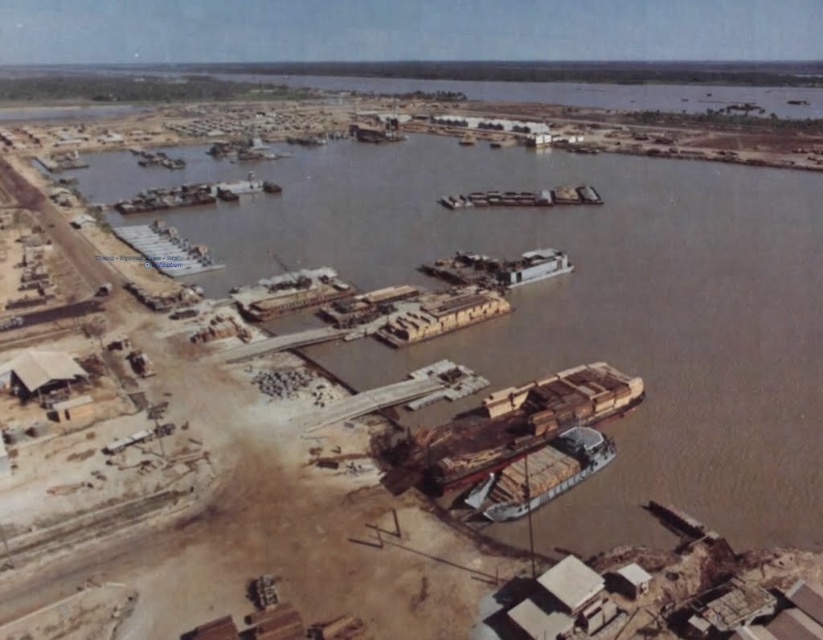
Question: Is wooden planks at center thinner than wooden planks boat at center?

Choices:
 (A) yes
 (B) no

Answer: (A)

Question: Estimate the real-world distances between objects in this image. Which object is closer to the wooden planks boat at center?

Choices:
 (A) wooden planks at center
 (B) wooden planks boat at lower center
 (C) brown wooden dock at center

Answer: (C)

Question: Which point is farther to the camera?

Choices:
 (A) (519, 200)
 (B) (159, 232)
 (C) (500, 508)

Answer: (A)

Question: Does wooden planks at center appear under wooden planks boat at center?

Choices:
 (A) no
 (B) yes

Answer: (B)

Question: Which point is farther from the camera taking this photo?

Choices:
 (A) (131, 227)
 (B) (808, 476)

Answer: (A)

Question: Is wooden planks at center above wooden planks boat at center?

Choices:
 (A) yes
 (B) no

Answer: (B)